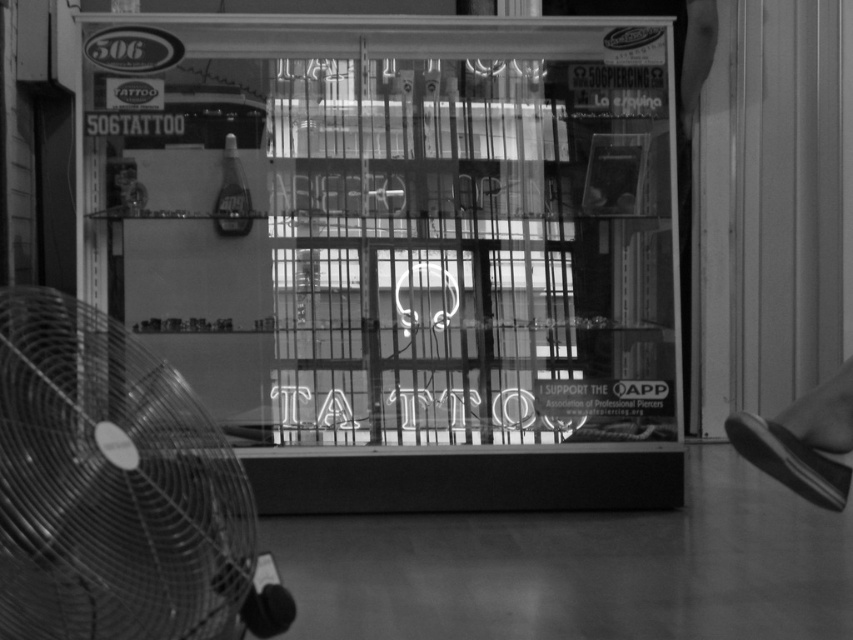
Which of these two, neon sign tattoo at center or metallic fan at left, stands shorter?

metallic fan at left

Between neon sign tattoo at center and metallic fan at left, which one is positioned higher?

neon sign tattoo at center is above.

Where is `neon sign tattoo at center`? neon sign tattoo at center is located at coordinates (416, 224).